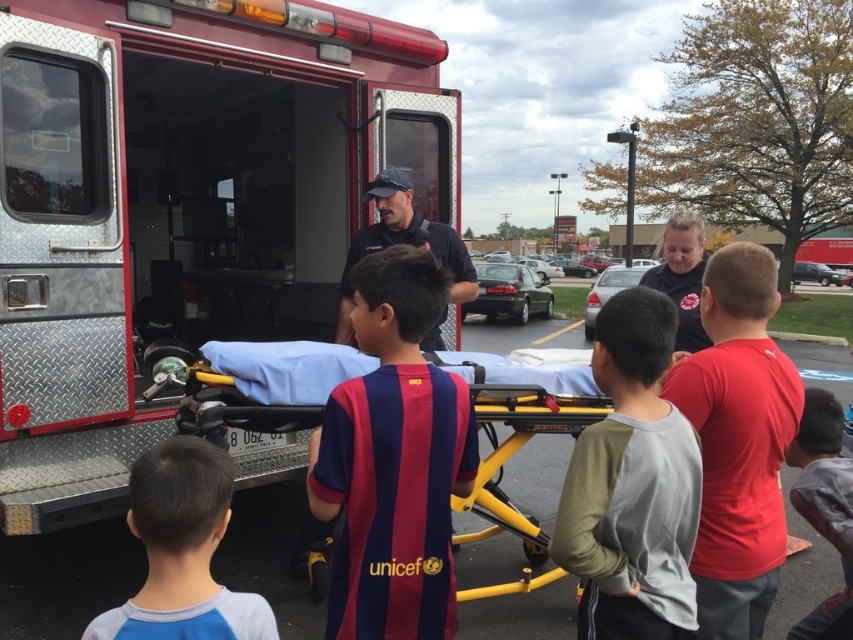
Question: Among these points, which one is nearest to the camera?

Choices:
 (A) (212, 525)
 (B) (47, 230)
 (C) (581, 547)
 (D) (434, 237)

Answer: (A)

Question: Which of the following is the closest to the observer?

Choices:
 (A) (165, 442)
 (B) (834, 538)
 (C) (802, 268)
 (D) (165, 364)

Answer: (A)

Question: Can you confirm if metallic silver fire truck at left is positioned to the left of yellow metallic stretcher at center?

Choices:
 (A) yes
 (B) no

Answer: (A)

Question: Which point is farther to the camera?

Choices:
 (A) (521, 316)
 (B) (283, 348)

Answer: (A)

Question: Is yellow metallic stretcher at center to the right of metallic silver stretcher at center from the viewer's perspective?

Choices:
 (A) no
 (B) yes

Answer: (A)

Question: Can you confirm if red cotton shirt at center is smaller than dark gray cotton shirt at lower right?

Choices:
 (A) yes
 (B) no

Answer: (A)